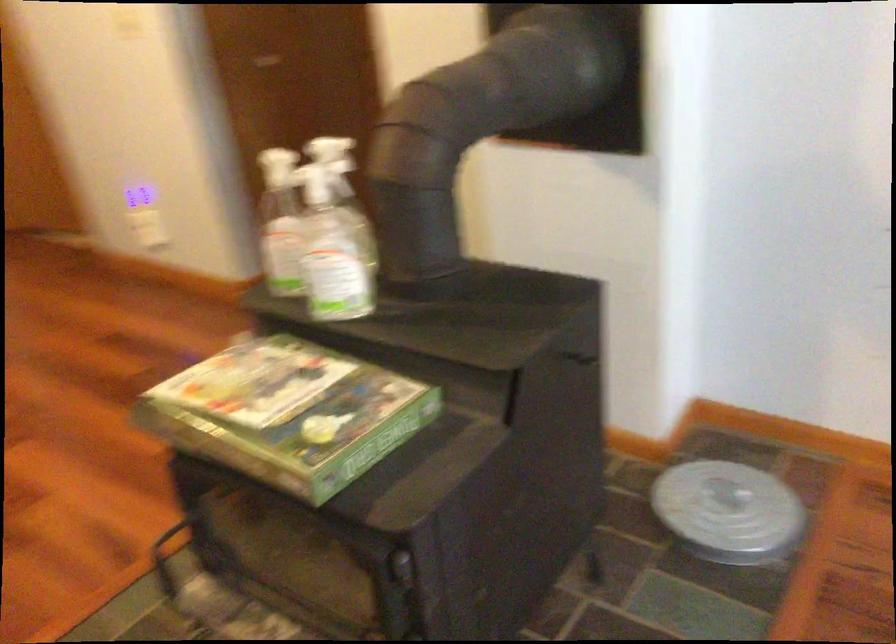
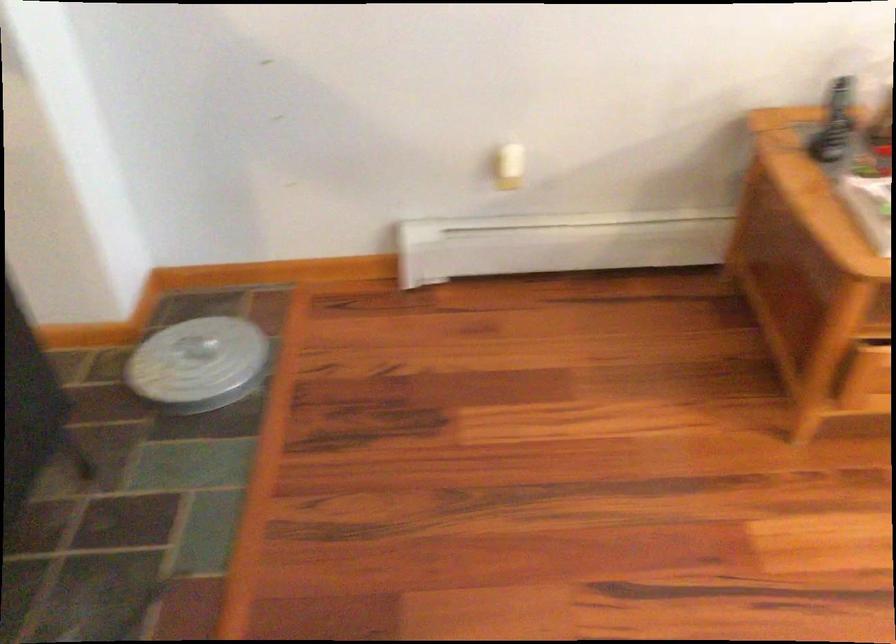
Question: The first image is from the beginning of the video and the second image is from the end. How did the camera likely rotate when shooting the video?

Choices:
 (A) Left
 (B) Right
 (C) Up
 (D) Down

Answer: (B)